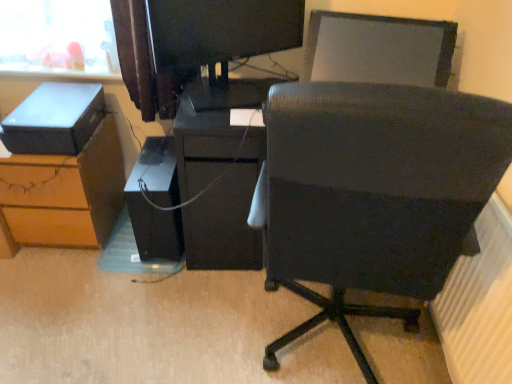
Locate an element on the screen. The height and width of the screenshot is (384, 512). free location in front of matte black desk at center is located at coordinates (191, 306).